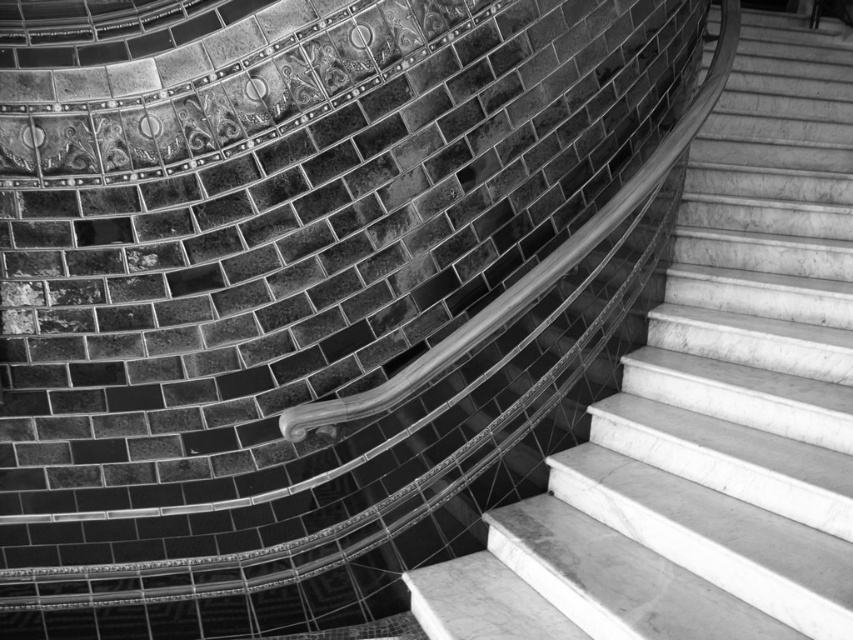
Question: Among these points, which one is nearest to the camera?

Choices:
 (A) coord(819,218)
 (B) coord(717,48)

Answer: (B)

Question: Does white marble stairs at center appear over metallic polished handrail at center?

Choices:
 (A) yes
 (B) no

Answer: (A)

Question: Does white marble stairs at center appear on the left side of metallic polished handrail at center?

Choices:
 (A) no
 (B) yes

Answer: (A)

Question: From the image, what is the correct spatial relationship of white marble stairs at center in relation to metallic polished handrail at center?

Choices:
 (A) right
 (B) left

Answer: (A)